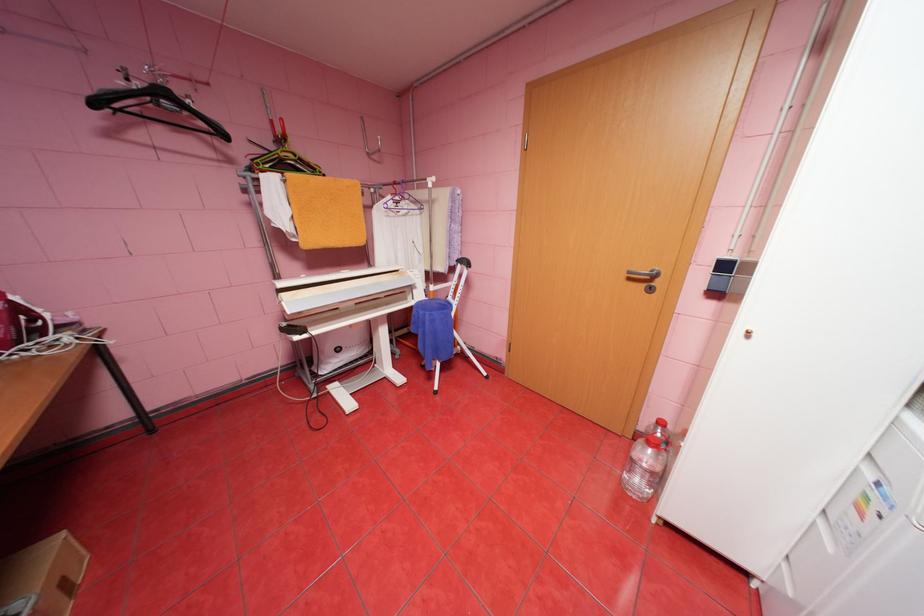
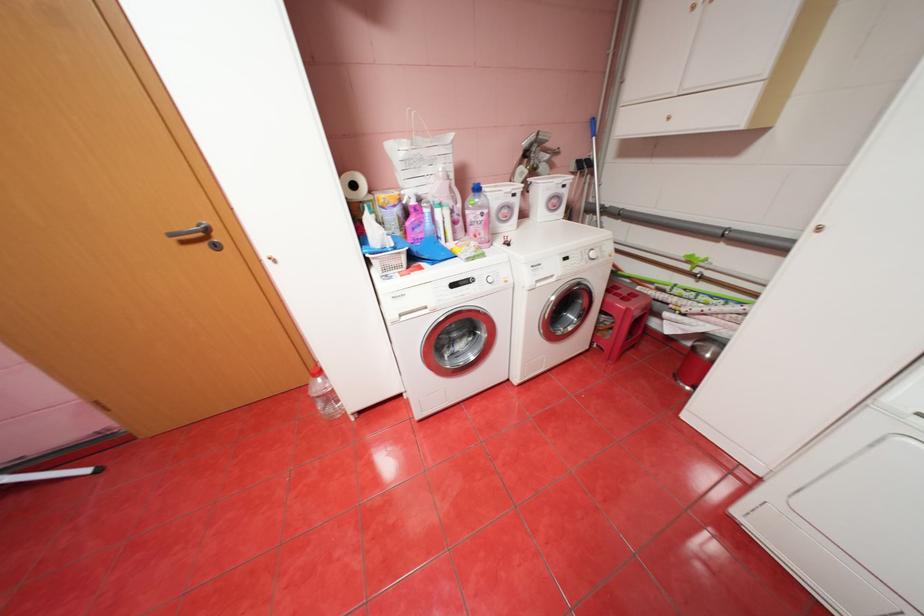
Find the pixel in the second image that matches the point at 650,285 in the first image.

(213, 245)